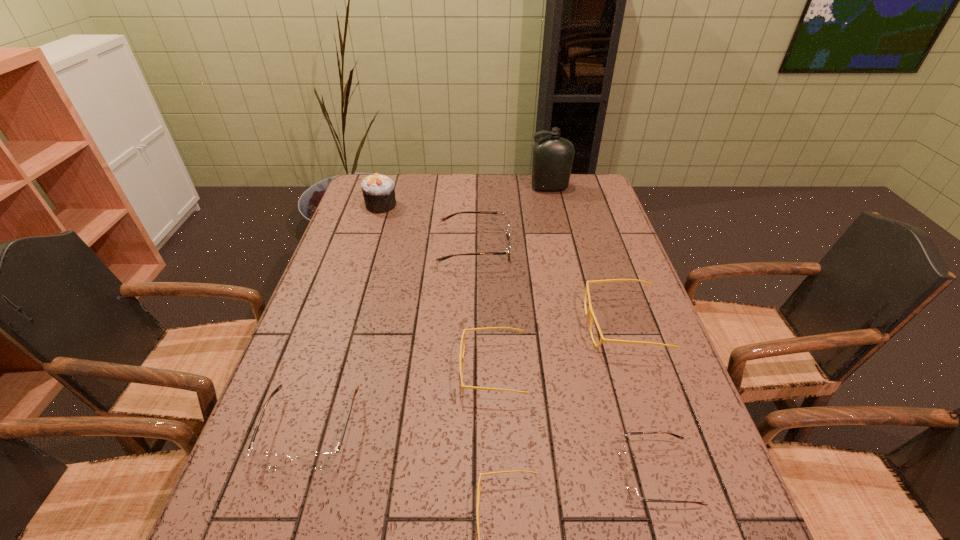
Identify which beige spectacles is located as the third nearest to the bottle. Please provide its 2D coordinates. Your answer should be formatted as a tuple, i.e. [(x, y)], where the tuple contains the x and y coordinates of a point satisfying the conditions above.

[(479, 483)]

This screenshot has height=540, width=960. In order to click on vacant area that satisfies the following two spatial constraints: 1. in front of the lenses of the rightmost beige spectacles; 2. on the front-facing side of the leftmost spectacles in this screenshot , I will do `click(658, 429)`.